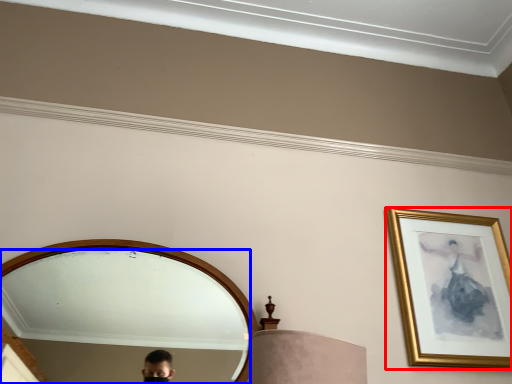
Question: Which object is further to the camera taking this photo, picture frame (highlighted by a red box) or mirror (highlighted by a blue box)?

Choices:
 (A) picture frame
 (B) mirror

Answer: (A)